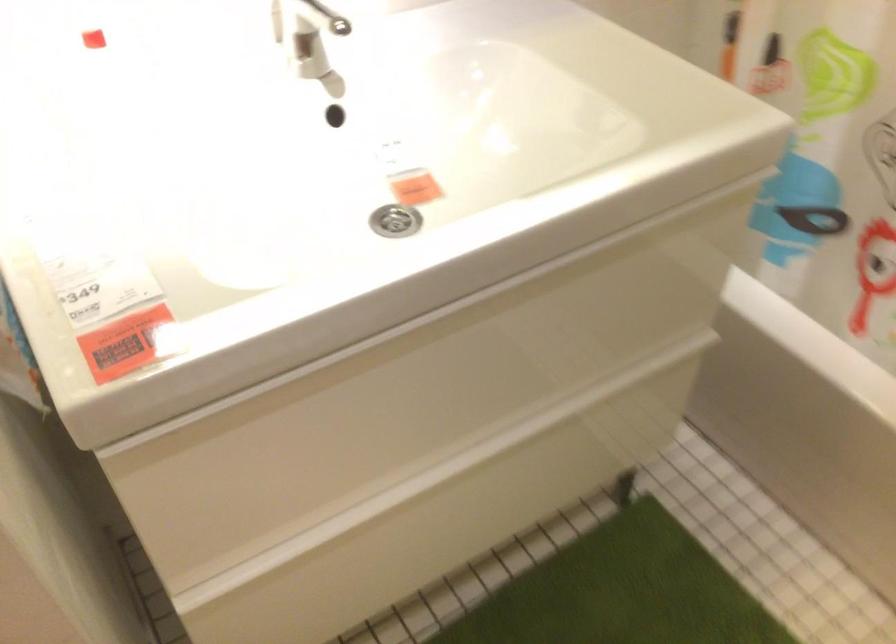
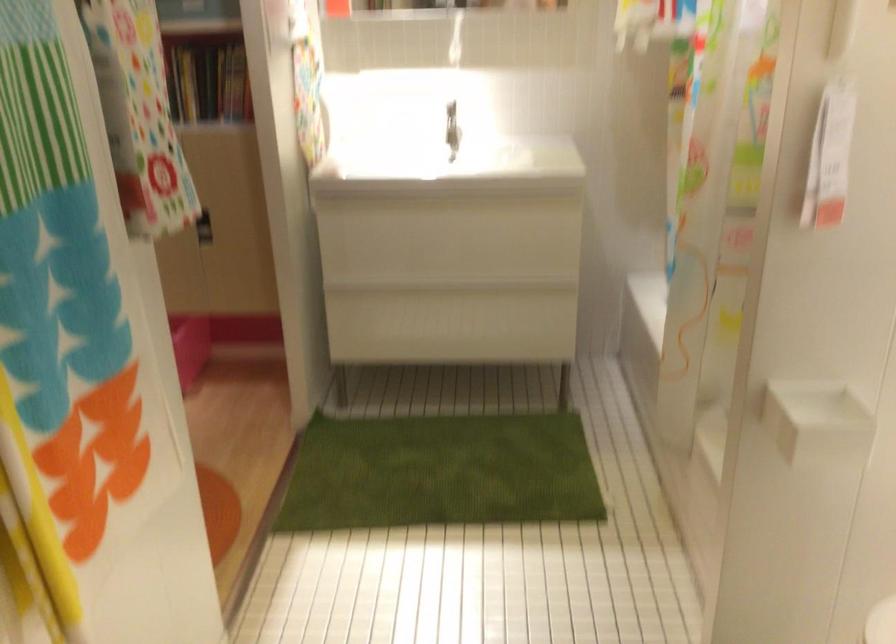
Locate, in the second image, the point that corresponds to (x=479, y=448) in the first image.

(453, 288)